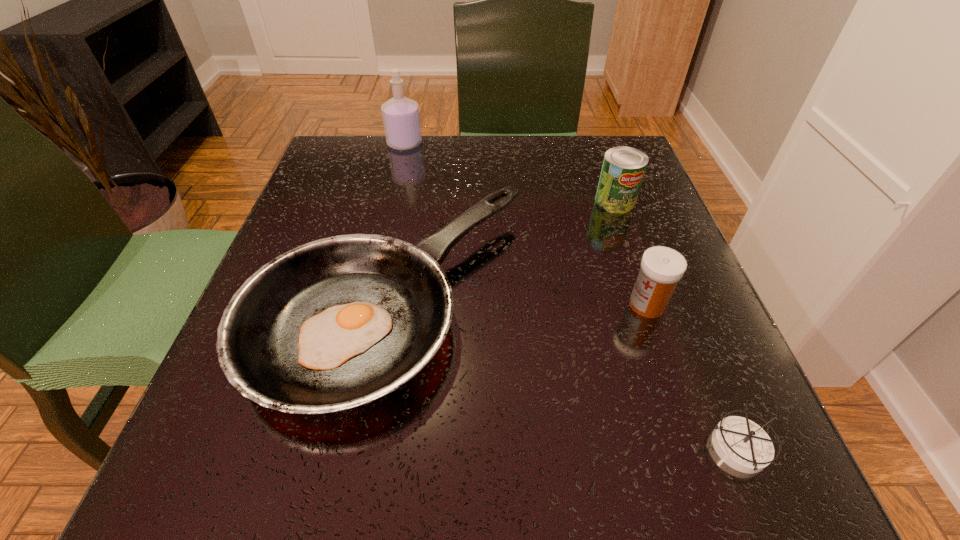
Where is `object positioned at the far left corner`? The height and width of the screenshot is (540, 960). object positioned at the far left corner is located at coordinates (401, 119).

At what (x,y) coordinates should I click in order to perform the action: click on object present at the near left corner. Please return your answer as a coordinate pair (x, y). Looking at the image, I should click on (336, 323).

I want to click on object present at the far right corner, so click(x=623, y=169).

Where is `object located in the near right corner section of the desktop`? The image size is (960, 540). object located in the near right corner section of the desktop is located at coordinates (742, 444).

Identify the location of free space at the far edge of the desktop. (472, 138).

At what (x,y) coordinates should I click in order to perform the action: click on free space at the near edge of the desktop. Please return your answer as a coordinate pair (x, y). The height and width of the screenshot is (540, 960). Looking at the image, I should click on (499, 477).

In the image, there is a desktop. Find the location of `free region at the left edge`. free region at the left edge is located at coordinates coord(358,217).

Locate an element on the screen. The height and width of the screenshot is (540, 960). vacant space at the right edge is located at coordinates (686, 307).

The image size is (960, 540). In order to click on blank space at the far left corner of the desktop in this screenshot , I will do `click(343, 139)`.

This screenshot has width=960, height=540. Identify the location of vacant space at the near left corner. (171, 496).